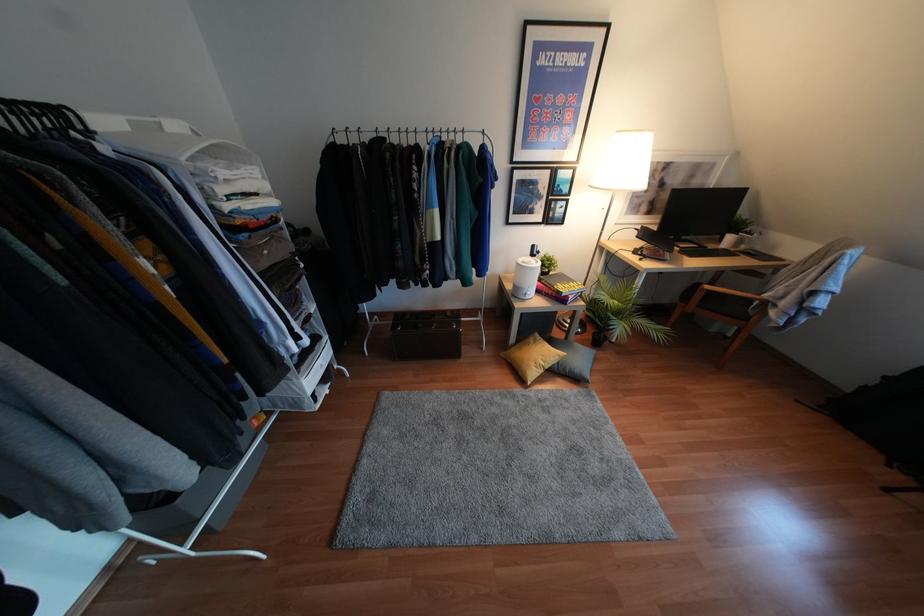
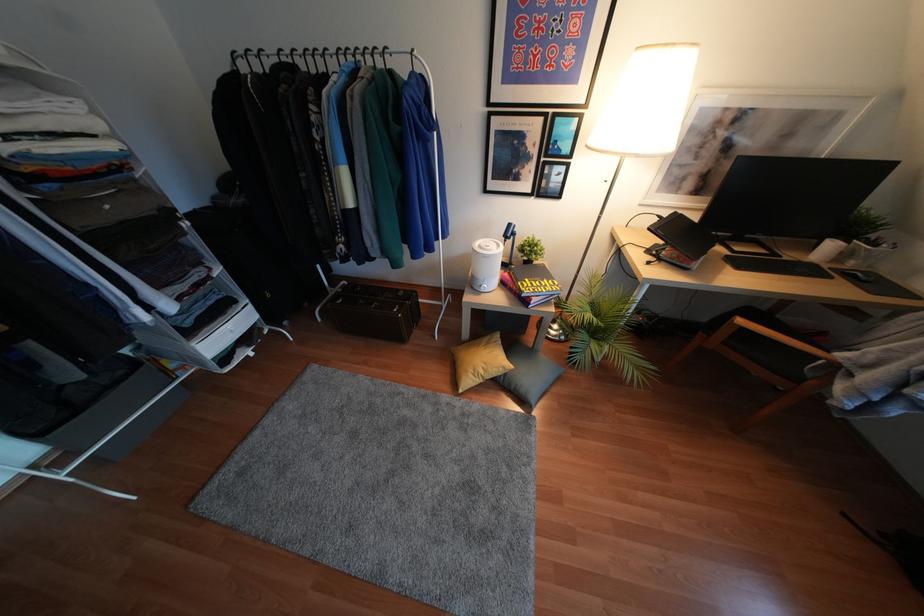
Where in the second image is the point corresponding to point (526, 297) from the first image?

(481, 290)